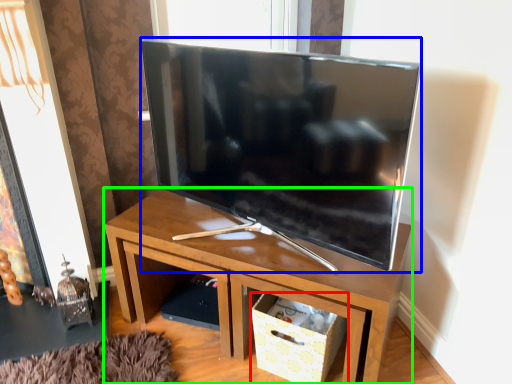
Question: Which is nearer to the storage box (highlighted by a red box)? television (highlighted by a blue box) or desk (highlighted by a green box).

Choices:
 (A) television
 (B) desk

Answer: (B)